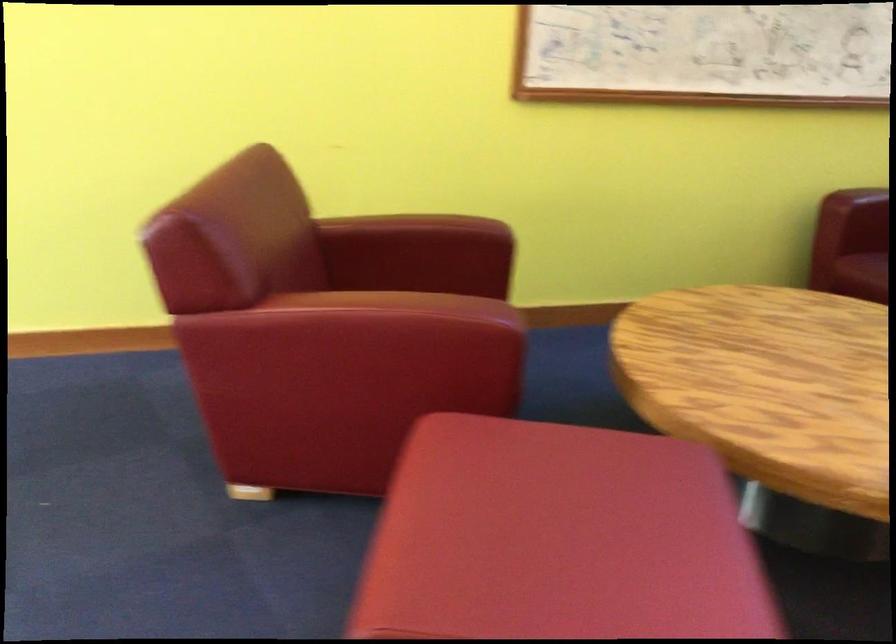
Find where to sit the red chair sitting surface. Please return your answer as a coordinate pair (x, y).

(418, 254)